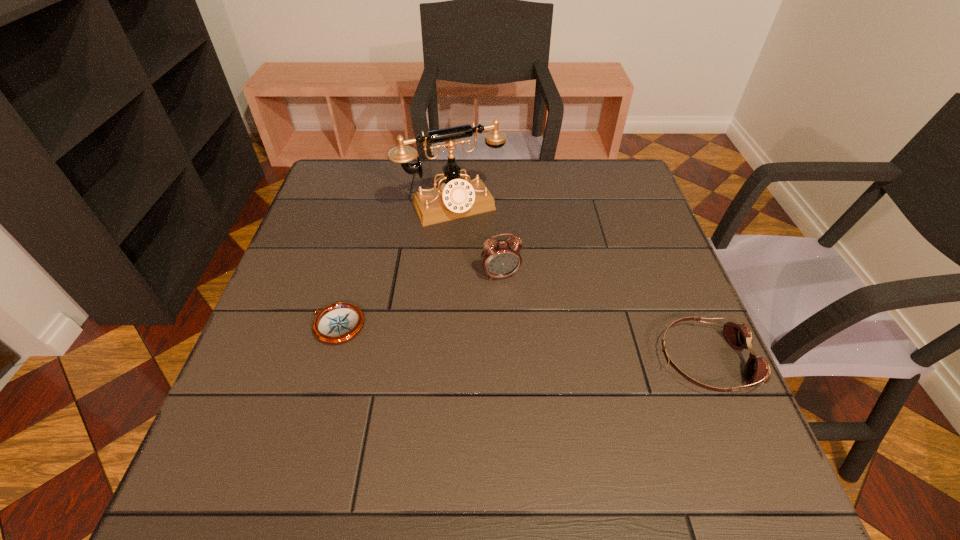
I want to click on the shortest object, so click(337, 323).

Image resolution: width=960 pixels, height=540 pixels. I want to click on compass, so click(x=337, y=323).

Identify the location of the second shortest object. Image resolution: width=960 pixels, height=540 pixels. pyautogui.click(x=739, y=336).

At what (x,y) coordinates should I click in order to perform the action: click on the rightmost object. Please return your answer as a coordinate pair (x, y). The image size is (960, 540). Looking at the image, I should click on (739, 336).

I want to click on the second tallest object, so click(x=500, y=258).

You are a GUI agent. You are given a task and a screenshot of the screen. Output one action in this format:
    pyautogui.click(x=<x>, y=<y>)
    Task: Click on the alarm clock
    This screenshot has height=540, width=960.
    Given the screenshot: What is the action you would take?
    pyautogui.click(x=500, y=258)

Image resolution: width=960 pixels, height=540 pixels. I want to click on telephone, so click(456, 198).

You are a GUI agent. You are given a task and a screenshot of the screen. Output one action in this format:
    pyautogui.click(x=<x>, y=<y>)
    Task: Click on the tallest object
    The height and width of the screenshot is (540, 960).
    Given the screenshot: What is the action you would take?
    pyautogui.click(x=456, y=198)

Locate an element on the screen. vacant space located on the right of the compass is located at coordinates (459, 326).

At what (x,y) coordinates should I click in order to perform the action: click on free region located 0.120m on the face of the third nearest object. Please return your answer as a coordinate pair (x, y). Image resolution: width=960 pixels, height=540 pixels. Looking at the image, I should click on (519, 323).